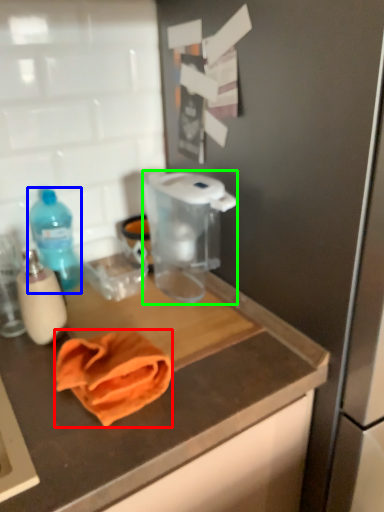
Question: Which is nearer to the towel/napkin (highlighted by a red box)? bottle (highlighted by a blue box) or appliance (highlighted by a green box).

Choices:
 (A) bottle
 (B) appliance

Answer: (B)